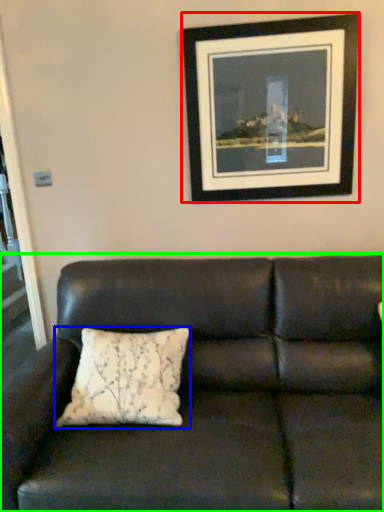
Question: Estimate the real-world distances between objects in this image. Which object is farther from picture frame (highlighted by a red box), pillow (highlighted by a blue box) or studio couch (highlighted by a green box)?

Choices:
 (A) pillow
 (B) studio couch

Answer: (A)